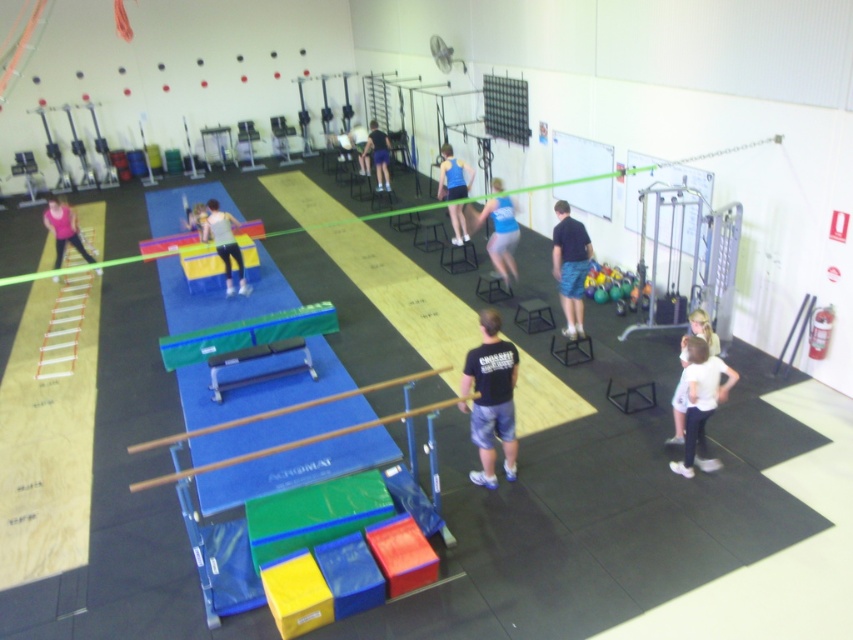
Describe the element at coordinates (224, 244) in the screenshot. I see `matte white shirt at center` at that location.

Looking at this image, does matte white shirt at center appear on the right side of blue fabric tank top at center?

In fact, matte white shirt at center is to the left of blue fabric tank top at center.

Where is `matte white shirt at center`? This screenshot has width=853, height=640. matte white shirt at center is located at coordinates (224, 244).

Does blue fabric shorts at center lie behind white cotton shirt at lower right?

Yes.

Is blue fabric shorts at center closer to camera compared to white cotton shirt at lower right?

No, blue fabric shorts at center is further to the viewer.

Is point (494, 244) closer to viewer compared to point (675, 428)?

No, (494, 244) is further to viewer.

Find the location of a particular element. This screenshot has width=853, height=640. blue fabric shorts at center is located at coordinates (x=500, y=230).

Consider the image. Does black cotton t-shirt at center appear on the right side of blue fabric shorts at center?

In fact, black cotton t-shirt at center is to the left of blue fabric shorts at center.

Which is behind, point (500, 406) or point (503, 259)?

Positioned behind is point (503, 259).

This screenshot has width=853, height=640. What are the coordinates of `black cotton t-shirt at center` in the screenshot? It's located at (491, 397).